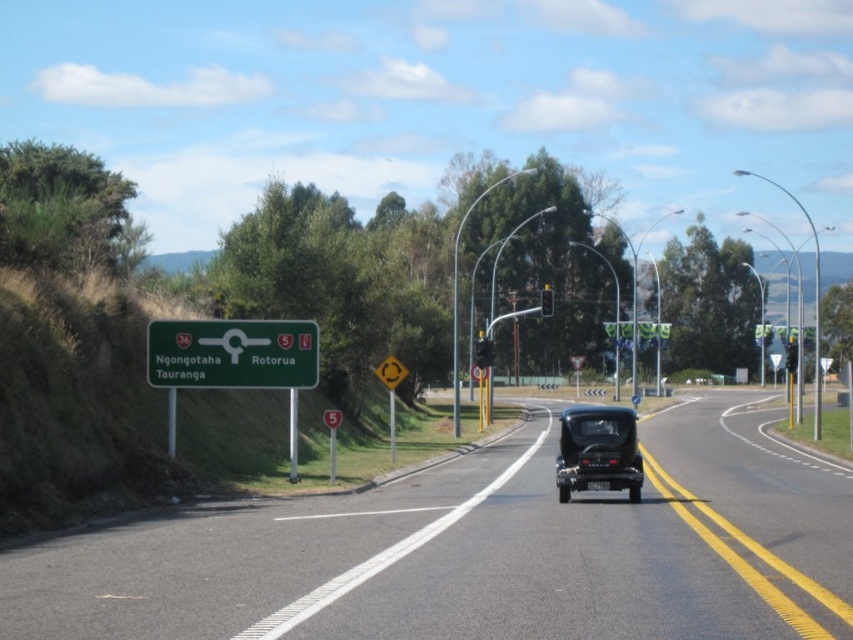
Does point (679, 445) lie in front of point (252, 387)?

No, it is not.

The height and width of the screenshot is (640, 853). Describe the element at coordinates (482, 552) in the screenshot. I see `black asphalt road at center` at that location.

This screenshot has width=853, height=640. What do you see at coordinates (482, 552) in the screenshot?
I see `black asphalt road at center` at bounding box center [482, 552].

Where is `black asphalt road at center`? The width and height of the screenshot is (853, 640). black asphalt road at center is located at coordinates (482, 552).

Is green matte sign at left thinner than shiny black car at center?

In fact, green matte sign at left might be wider than shiny black car at center.

Between green matte sign at left and shiny black car at center, which one is positioned lower?

shiny black car at center is below.

Where is `green matte sign at left`? The height and width of the screenshot is (640, 853). green matte sign at left is located at coordinates (231, 353).

Is point (564, 540) positioned before point (619, 490)?

Yes.

Where is `black asphalt road at center`? The height and width of the screenshot is (640, 853). black asphalt road at center is located at coordinates (x=482, y=552).

Is point (289, 536) farther from viewer compared to point (587, 424)?

That is False.

Identify the location of black asphalt road at center. tap(482, 552).